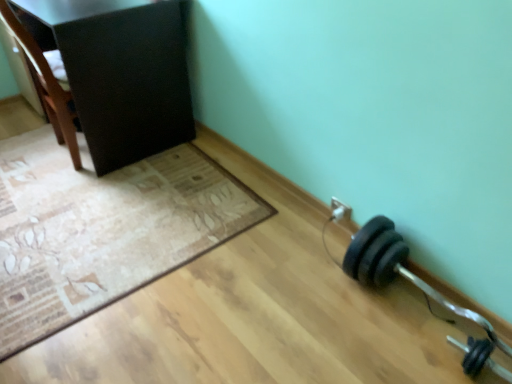
Question: Is black rubber dumbbell at lower right, the second dumbbell viewed from the top, to the left or to the right of black rubber dumbbell at lower right, the second dumbbell when ordered from bottom to top, in the image?

Choices:
 (A) left
 (B) right

Answer: (B)

Question: From the image's perspective, is black rubber dumbbell at lower right, placed as the 1th dumbbell when sorted from bottom to top, positioned above or below black rubber dumbbell at lower right, which is the 1th dumbbell from top to bottom?

Choices:
 (A) below
 (B) above

Answer: (A)

Question: Which object is the farthest from the brown wood chair at upper left?

Choices:
 (A) beige textured mat at lower left
 (B) black rubber dumbbell at lower right, which is the 1th dumbbell from top to bottom
 (C) black rubber dumbbell at lower right, placed as the 1th dumbbell when sorted from bottom to top
 (D) matte black cabinet at upper left

Answer: (C)

Question: Estimate the real-world distances between objects in this image. Which object is farther from the beige textured mat at lower left?

Choices:
 (A) black rubber dumbbell at lower right, which is the 1th dumbbell from top to bottom
 (B) matte black cabinet at upper left
 (C) brown wood chair at upper left
 (D) black rubber dumbbell at lower right, the second dumbbell viewed from the top

Answer: (D)